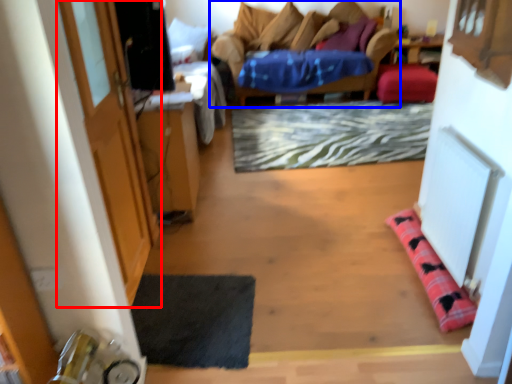
Question: Which of the following is the farthest to the observer, door (highlighted by a red box) or furniture (highlighted by a blue box)?

Choices:
 (A) door
 (B) furniture

Answer: (B)